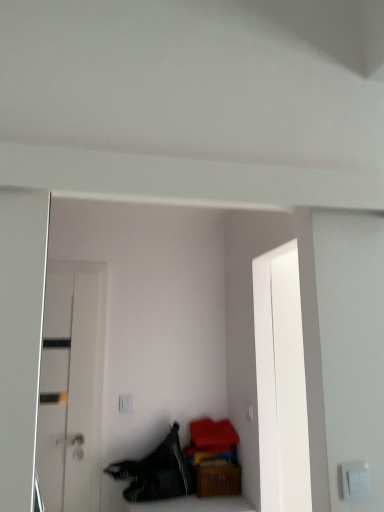
Question: Are white glossy door at left and black textured fabric at lower left far apart?

Choices:
 (A) no
 (B) yes

Answer: (A)

Question: From the image's perspective, is white glossy door at left below black textured fabric at lower left?

Choices:
 (A) no
 (B) yes

Answer: (A)

Question: From a real-world perspective, is white glossy door at left positioned under black textured fabric at lower left based on gravity?

Choices:
 (A) yes
 (B) no

Answer: (B)

Question: Is white glossy door at left facing away from black textured fabric at lower left?

Choices:
 (A) no
 (B) yes

Answer: (A)

Question: Considering the relative sizes of white glossy door at left and black textured fabric at lower left in the image provided, is white glossy door at left shorter than black textured fabric at lower left?

Choices:
 (A) yes
 (B) no

Answer: (B)

Question: Is white glossy door at left facing towards black textured fabric at lower left?

Choices:
 (A) yes
 (B) no

Answer: (B)

Question: Could white glossy door at left be considered to be inside black textured fabric at lower left?

Choices:
 (A) no
 (B) yes

Answer: (A)

Question: Considering the relative sizes of black textured fabric at lower left and white glossy door at left in the image provided, is black textured fabric at lower left taller than white glossy door at left?

Choices:
 (A) no
 (B) yes

Answer: (A)

Question: Can you confirm if black textured fabric at lower left is wider than white glossy door at left?

Choices:
 (A) no
 (B) yes

Answer: (B)

Question: Considering the relative sizes of black textured fabric at lower left and white glossy door at left in the image provided, is black textured fabric at lower left thinner than white glossy door at left?

Choices:
 (A) yes
 (B) no

Answer: (B)

Question: Is black textured fabric at lower left to the left of white glossy door at left from the viewer's perspective?

Choices:
 (A) no
 (B) yes

Answer: (A)

Question: From the image's perspective, would you say black textured fabric at lower left is positioned over white glossy door at left?

Choices:
 (A) yes
 (B) no

Answer: (B)

Question: Considering the relative sizes of black textured fabric at lower left and white plastic switch at lower right in the image provided, is black textured fabric at lower left thinner than white plastic switch at lower right?

Choices:
 (A) yes
 (B) no

Answer: (B)